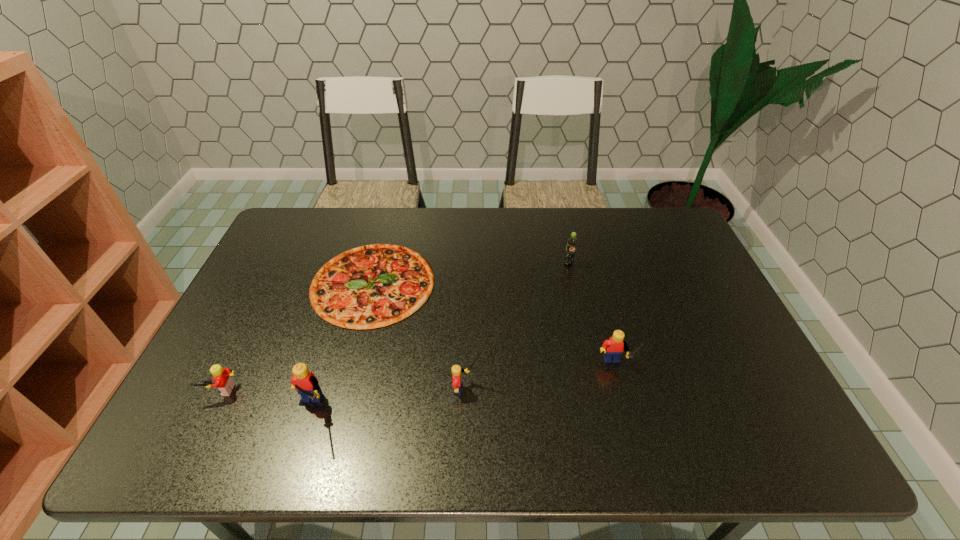
Where is `free space located on the front-facing side of the third shortest Lego`? Image resolution: width=960 pixels, height=540 pixels. free space located on the front-facing side of the third shortest Lego is located at coordinates (624, 405).

This screenshot has width=960, height=540. Find the location of `vacant space positioned 0.380m on the right of the shortest object`. vacant space positioned 0.380m on the right of the shortest object is located at coordinates (560, 284).

At what (x,y) coordinates should I click in order to perform the action: click on free region located 0.070m on the front label of the second object from right to left. Please return your answer as a coordinate pair (x, y). Looking at the image, I should click on (573, 282).

Image resolution: width=960 pixels, height=540 pixels. Find the location of `object that is at the far edge`. object that is at the far edge is located at coordinates (371, 286).

The height and width of the screenshot is (540, 960). What are the coordinates of `object that is positioned at the left edge` in the screenshot? It's located at (222, 380).

Find the location of a particular element. Image resolution: width=960 pixels, height=540 pixels. object that is at the near left corner is located at coordinates (222, 380).

Find the location of a particular element. vacant space at the far edge of the desktop is located at coordinates (623, 234).

The width and height of the screenshot is (960, 540). In order to click on free space at the near edge of the desktop in this screenshot , I will do `click(628, 411)`.

Locate an element on the screen. vacant space at the left edge of the desktop is located at coordinates (295, 287).

You are a GUI agent. You are given a task and a screenshot of the screen. Output one action in this format:
    pyautogui.click(x=<x>, y=<y>)
    Task: Click on the free location at the right edge
    The height and width of the screenshot is (540, 960).
    Given the screenshot: What is the action you would take?
    pyautogui.click(x=660, y=280)